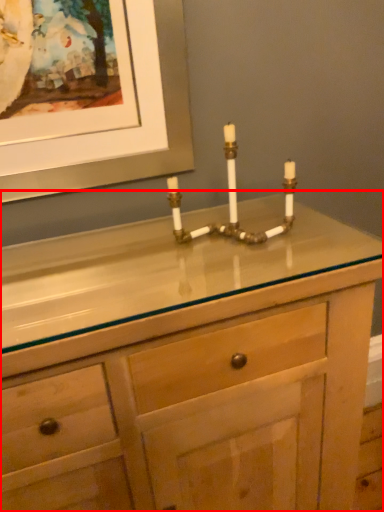
Question: From the image's perspective, where is chest of drawers (annotated by the red box) located relative to candle holder?

Choices:
 (A) below
 (B) above

Answer: (A)